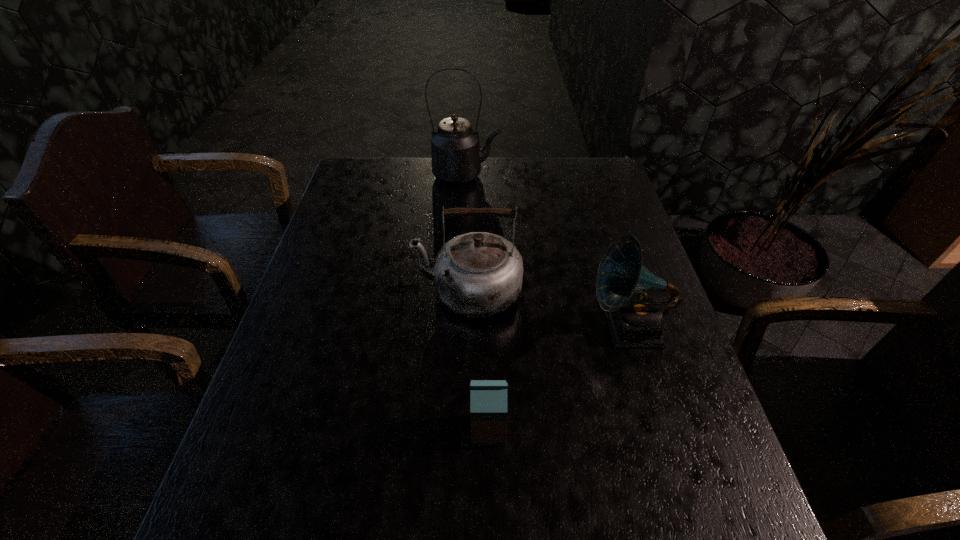
This screenshot has height=540, width=960. What are the coordinates of `vacant space at the near left corner` in the screenshot? It's located at (292, 536).

Locate an element on the screen. The width and height of the screenshot is (960, 540). free space between the farthest object and the phonograph_record is located at coordinates (547, 252).

The image size is (960, 540). I want to click on free spot between the shortest object and the phonograph_record, so click(558, 379).

Where is `free space that is in between the shortest object and the shorter kettle`? The height and width of the screenshot is (540, 960). free space that is in between the shortest object and the shorter kettle is located at coordinates (478, 360).

You are a GUI agent. You are given a task and a screenshot of the screen. Output one action in this format:
    pyautogui.click(x=<x>, y=<y>)
    Task: Click on the free space that is in between the shortest object and the nearer kettle
    
    Given the screenshot: What is the action you would take?
    pyautogui.click(x=478, y=360)

This screenshot has height=540, width=960. Find the location of `unoccupied position between the rightmost object and the taller kettle`. unoccupied position between the rightmost object and the taller kettle is located at coordinates (547, 252).

This screenshot has width=960, height=540. In order to click on blank region between the nearer kettle and the rightmost object in this screenshot , I will do [548, 309].

Image resolution: width=960 pixels, height=540 pixels. I want to click on object that stands as the third closest to the farther kettle, so click(488, 398).

Identify which object is the closest to the tallest object. Please provide its 2D coordinates. Your answer should be formatted as a tuple, i.e. [(x, y)], where the tuple contains the x and y coordinates of a point satisfying the conditions above.

[(478, 274)]

Where is `vacant region that satisfies the following two spatial constraints: 1. at the spout of the nearer kettle; 2. spout on the taller kettle`? The image size is (960, 540). vacant region that satisfies the following two spatial constraints: 1. at the spout of the nearer kettle; 2. spout on the taller kettle is located at coordinates (471, 176).